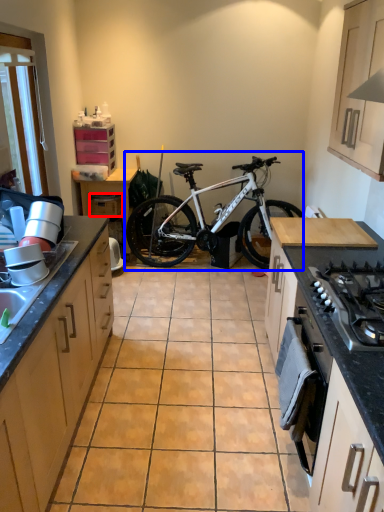
Question: Which object appears farthest to the camera in this image, drawer (highlighted by a red box) or bicycle (highlighted by a blue box)?

Choices:
 (A) drawer
 (B) bicycle

Answer: (A)